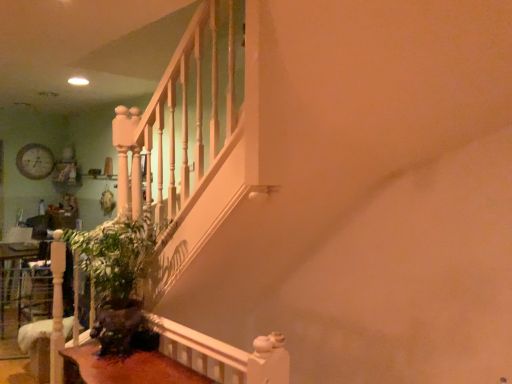
Question: In terms of height, does wooden clock at upper left look taller or shorter compared to green matte plant at lower left?

Choices:
 (A) tall
 (B) short

Answer: (B)

Question: Based on their positions, is wooden clock at upper left located to the left or right of green matte plant at lower left?

Choices:
 (A) right
 (B) left

Answer: (B)

Question: Which object is the closest to the brown wooden table at lower left?

Choices:
 (A) wooden clock at upper left
 (B) green matte plant at lower left

Answer: (B)

Question: Based on their relative distances, which object is nearer to the green matte plant at lower left?

Choices:
 (A) brown wooden table at lower left
 (B) wooden clock at upper left

Answer: (A)